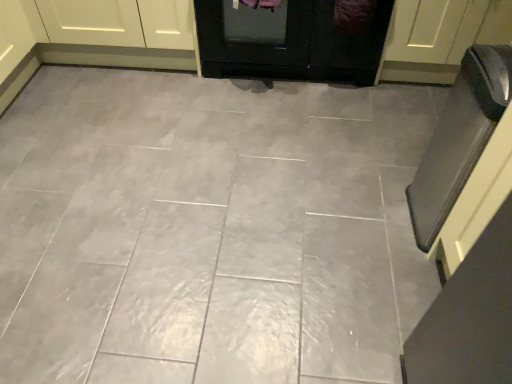
Question: Is matte white cabinet at upper left to the right of gray glossy tile at center from the viewer's perspective?

Choices:
 (A) no
 (B) yes

Answer: (A)

Question: Is matte white cabinet at upper left behind gray glossy tile at center?

Choices:
 (A) yes
 (B) no

Answer: (A)

Question: Is matte white cabinet at upper left positioned beyond the bounds of gray glossy tile at center?

Choices:
 (A) yes
 (B) no

Answer: (A)

Question: From the image's perspective, is matte white cabinet at upper left located above gray glossy tile at center?

Choices:
 (A) no
 (B) yes

Answer: (B)

Question: Is there a large distance between matte white cabinet at upper left and gray glossy tile at center?

Choices:
 (A) yes
 (B) no

Answer: (B)

Question: Does point (480, 127) appear closer or farther from the camera than point (467, 1)?

Choices:
 (A) farther
 (B) closer

Answer: (B)

Question: Is black glass oven at right in front of or behind white glossy door at upper right, the second door when ordered from left to right, in the image?

Choices:
 (A) behind
 (B) front

Answer: (B)

Question: Is black glass oven at right wider or thinner than white glossy door at upper right, which appears as the first door when viewed from the right?

Choices:
 (A) wide
 (B) thin

Answer: (B)

Question: Is black glass oven at right situated inside white glossy door at upper right, which appears as the first door when viewed from the right, or outside?

Choices:
 (A) inside
 (B) outside

Answer: (B)

Question: Which is correct: gray glossy tile at center is inside black glossy door at center, the second door in the right-to-left sequence, or outside of it?

Choices:
 (A) inside
 (B) outside

Answer: (B)

Question: Is gray glossy tile at center taller or shorter than black glossy door at center, marked as the first door in a left-to-right arrangement?

Choices:
 (A) tall
 (B) short

Answer: (B)

Question: Considering the relative positions of gray glossy tile at center and black glossy door at center, the second door in the right-to-left sequence, in the image provided, is gray glossy tile at center to the left or to the right of black glossy door at center, the second door in the right-to-left sequence,?

Choices:
 (A) left
 (B) right

Answer: (A)

Question: From a real-world perspective, is gray glossy tile at center positioned above or below black glossy door at center, marked as the first door in a left-to-right arrangement?

Choices:
 (A) above
 (B) below

Answer: (B)

Question: Is matte white cabinet at upper left inside the boundaries of white glossy door at upper right, the second door when ordered from left to right, or outside?

Choices:
 (A) inside
 (B) outside

Answer: (B)

Question: From the image's perspective, is matte white cabinet at upper left located above or below white glossy door at upper right, which appears as the first door when viewed from the right?

Choices:
 (A) below
 (B) above

Answer: (B)